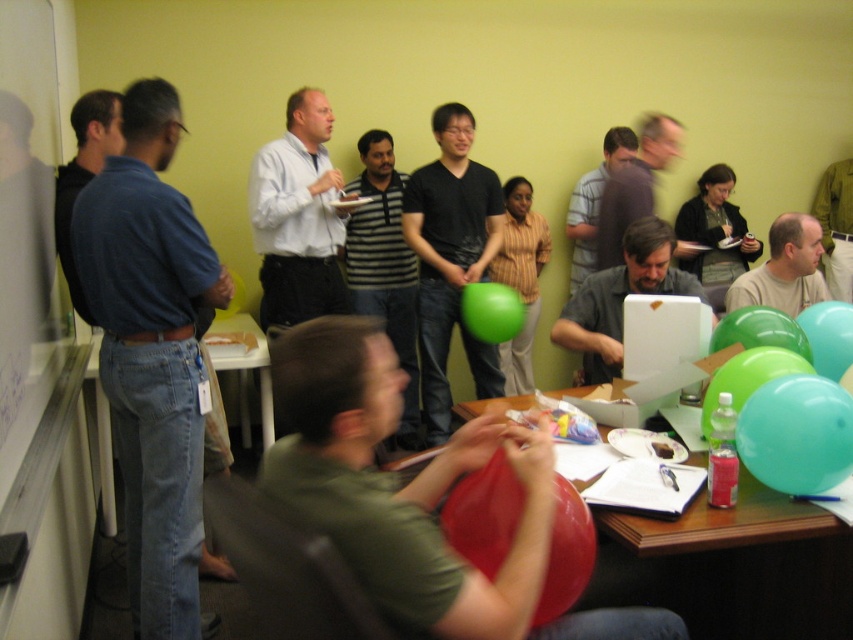
Question: Which point is closer to the camera taking this photo?

Choices:
 (A) (664, 148)
 (B) (679, 321)
 (C) (184, 620)

Answer: (C)

Question: Which object appears closest to the camera in this image?

Choices:
 (A) green matte balloon at right
 (B) striped shirt at center
 (C) striped cotton shirt at center

Answer: (A)

Question: In this image, where is matte green balloon at center located relative to rubber balloon at center?

Choices:
 (A) above
 (B) below

Answer: (A)

Question: Does light blue shirt at center have a larger size compared to matte black shirt at center?

Choices:
 (A) no
 (B) yes

Answer: (B)

Question: Can you confirm if black glossy shirt at center is positioned below light brown shirt at center?

Choices:
 (A) no
 (B) yes

Answer: (B)

Question: Which object appears farthest from the camera in this image?

Choices:
 (A) teal matte balloon at lower right
 (B) white plastic computer at center

Answer: (B)